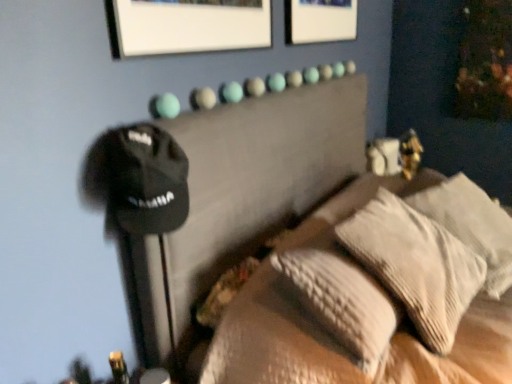
Question: Is white textured pillow at right, which is the second pillow from left to right, taller than textured beige pillow at center, the second pillow from the right?

Choices:
 (A) yes
 (B) no

Answer: (B)

Question: Is white textured pillow at right, the first pillow positioned from the right, in front of textured beige pillow at center, which is the first pillow from left to right?

Choices:
 (A) no
 (B) yes

Answer: (A)

Question: Could textured beige pillow at center, which is the first pillow from left to right, be considered to be inside white textured pillow at right, the first pillow positioned from the right?

Choices:
 (A) yes
 (B) no

Answer: (B)

Question: Is white textured pillow at right, the first pillow positioned from the right, to the right of textured beige pillow at center, the second pillow from the right, from the viewer's perspective?

Choices:
 (A) yes
 (B) no

Answer: (A)

Question: Is white textured pillow at right, which is the second pillow from left to right, shorter than textured beige pillow at center, which is the first pillow from left to right?

Choices:
 (A) yes
 (B) no

Answer: (A)

Question: In terms of height, does textured beige pillows at center look taller or shorter compared to black fabric bed at upper center?

Choices:
 (A) short
 (B) tall

Answer: (A)

Question: Is textured beige pillows at center in front of or behind black fabric bed at upper center in the image?

Choices:
 (A) behind
 (B) front

Answer: (A)

Question: In terms of size, does textured beige pillows at center appear bigger or smaller than black fabric bed at upper center?

Choices:
 (A) big
 (B) small

Answer: (B)

Question: From a real-world perspective, is textured beige pillows at center physically located above or below black fabric bed at upper center?

Choices:
 (A) below
 (B) above

Answer: (B)

Question: From a real-world perspective, relative to white textured pillow at right, the first pillow positioned from the right, is textured beige pillow at center, the second pillow from the right, vertically above or below?

Choices:
 (A) above
 (B) below

Answer: (A)

Question: Is point (453, 336) positioned closer to the camera than point (466, 233)?

Choices:
 (A) closer
 (B) farther

Answer: (A)

Question: In the image, is textured beige pillow at center, the second pillow from the right, positioned in front of or behind white textured pillow at right, the first pillow positioned from the right?

Choices:
 (A) behind
 (B) front

Answer: (B)

Question: From their relative heights in the image, would you say textured beige pillow at center, which is the first pillow from left to right, is taller or shorter than white textured pillow at right, the first pillow positioned from the right?

Choices:
 (A) short
 (B) tall

Answer: (B)

Question: Choose the correct answer: Is black fabric bed at upper center inside textured beige pillow at center, which is the first pillow from left to right, or outside it?

Choices:
 (A) inside
 (B) outside

Answer: (B)

Question: From the image's perspective, relative to textured beige pillow at center, which is the first pillow from left to right, is black fabric bed at upper center above or below?

Choices:
 (A) below
 (B) above

Answer: (A)